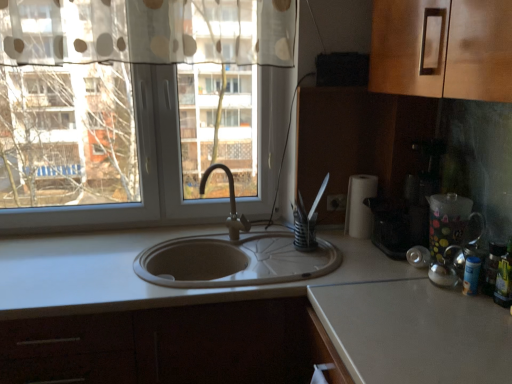
Question: Should I look upward or downward to see green glass bottle at right?

Choices:
 (A) down
 (B) up

Answer: (A)

Question: Is green glass bottle at right outside of white matte countertop at center?

Choices:
 (A) no
 (B) yes

Answer: (B)

Question: Considering the relative sizes of green glass bottle at right and white matte countertop at center in the image provided, is green glass bottle at right bigger than white matte countertop at center?

Choices:
 (A) no
 (B) yes

Answer: (A)

Question: Is green glass bottle at right not near white matte countertop at center?

Choices:
 (A) no
 (B) yes

Answer: (A)

Question: From the image's perspective, does green glass bottle at right appear higher than white matte countertop at center?

Choices:
 (A) no
 (B) yes

Answer: (B)

Question: Considering the relative sizes of green glass bottle at right and white matte countertop at center in the image provided, is green glass bottle at right smaller than white matte countertop at center?

Choices:
 (A) yes
 (B) no

Answer: (A)

Question: Is green glass bottle at right positioned before white matte countertop at center?

Choices:
 (A) no
 (B) yes

Answer: (A)

Question: Would you say green glass bottle at right is outside matte silver faucet at center?

Choices:
 (A) yes
 (B) no

Answer: (A)

Question: Can matte silver faucet at center be found inside green glass bottle at right?

Choices:
 (A) no
 (B) yes

Answer: (A)

Question: Considering the relative positions of green glass bottle at right and matte silver faucet at center in the image provided, is green glass bottle at right to the left of matte silver faucet at center from the viewer's perspective?

Choices:
 (A) no
 (B) yes

Answer: (A)

Question: From a real-world perspective, is green glass bottle at right located higher than matte silver faucet at center?

Choices:
 (A) no
 (B) yes

Answer: (A)

Question: Is green glass bottle at right directly adjacent to matte silver faucet at center?

Choices:
 (A) yes
 (B) no

Answer: (B)

Question: From the image's perspective, would you say green glass bottle at right is shown under matte silver faucet at center?

Choices:
 (A) no
 (B) yes

Answer: (B)

Question: From the image's perspective, is matte silver faucet at center above green glass bottle at right?

Choices:
 (A) yes
 (B) no

Answer: (A)